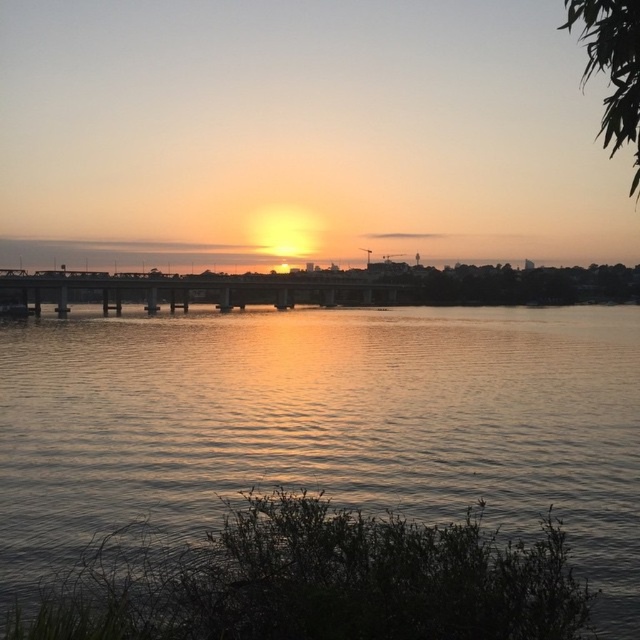
Question: Among these objects, which one is farthest from the camera?

Choices:
 (A) metallic bridge at center
 (B) silvery reflective water at center

Answer: (A)

Question: Is silvery reflective water at center above metallic bridge at center?

Choices:
 (A) yes
 (B) no

Answer: (B)

Question: Can you confirm if silvery reflective water at center is thinner than metallic bridge at center?

Choices:
 (A) no
 (B) yes

Answer: (B)

Question: Can you confirm if silvery reflective water at center is positioned to the left of metallic bridge at center?

Choices:
 (A) no
 (B) yes

Answer: (A)